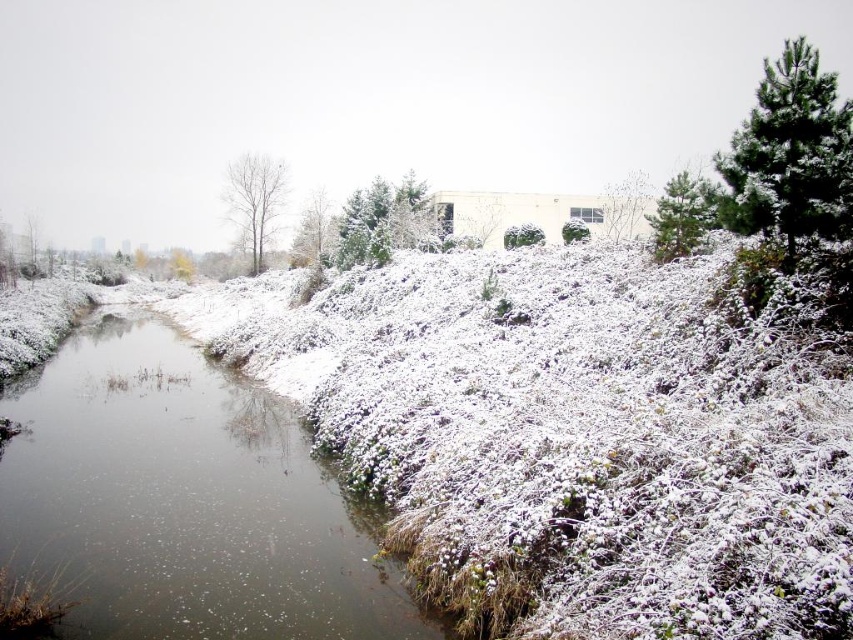
Is point (88, 612) in front of point (577, 220)?

Yes, it is in front of point (577, 220).

Is point (213, 451) positioned after point (572, 220)?

No.

Locate an element on the screen. This screenshot has width=853, height=640. clear water at center is located at coordinates (183, 500).

Which is below, snow-covered pine tree at upper right or white matte tree at center?

white matte tree at center is below.

Looking at this image, does snow-covered pine tree at upper right have a lesser height compared to white matte tree at center?

No.

Who is more forward, (763, 211) or (306, 260)?

Positioned in front is point (763, 211).

Identify the location of snow-covered pine tree at upper right. (791, 154).

Which is in front, point (824, 189) or point (242, 198)?

Point (824, 189) is more forward.

Does point (723, 168) lie in front of point (251, 216)?

Yes.

Locate an element on the screen. The image size is (853, 640). snow-covered pine tree at upper right is located at coordinates pyautogui.click(x=791, y=154).